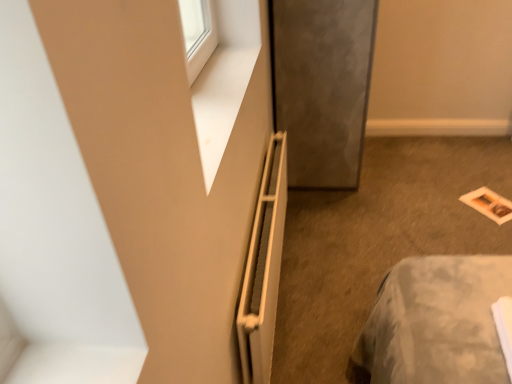
Question: Is matte paper magazine at lower right taller than matte gray screen door at center?

Choices:
 (A) no
 (B) yes

Answer: (A)

Question: Is matte gray screen door at center located within matte paper magazine at lower right?

Choices:
 (A) yes
 (B) no

Answer: (B)

Question: Can we say matte paper magazine at lower right lies outside matte gray screen door at center?

Choices:
 (A) no
 (B) yes

Answer: (B)

Question: Could you tell me if matte paper magazine at lower right is facing matte gray screen door at center?

Choices:
 (A) yes
 (B) no

Answer: (B)

Question: Are matte paper magazine at lower right and matte gray screen door at center far apart?

Choices:
 (A) yes
 (B) no

Answer: (A)

Question: From their relative heights in the image, would you say white matte radiator at center is taller or shorter than matte gray screen door at center?

Choices:
 (A) tall
 (B) short

Answer: (B)

Question: Choose the correct answer: Is white matte radiator at center inside matte gray screen door at center or outside it?

Choices:
 (A) outside
 (B) inside

Answer: (A)

Question: In the image, is white matte radiator at center positioned in front of or behind matte gray screen door at center?

Choices:
 (A) front
 (B) behind

Answer: (A)

Question: Considering the positions of point (246, 304) and point (352, 100), is point (246, 304) closer or farther from the camera than point (352, 100)?

Choices:
 (A) farther
 (B) closer

Answer: (B)

Question: Based on their sizes in the image, would you say matte gray screen door at center is bigger or smaller than matte paper magazine at lower right?

Choices:
 (A) big
 (B) small

Answer: (A)

Question: From a real-world perspective, is matte gray screen door at center positioned above or below matte paper magazine at lower right?

Choices:
 (A) below
 (B) above

Answer: (B)

Question: Considering the relative positions of matte gray screen door at center and matte paper magazine at lower right in the image provided, is matte gray screen door at center to the left or to the right of matte paper magazine at lower right?

Choices:
 (A) left
 (B) right

Answer: (A)

Question: Is matte gray screen door at center in front of or behind matte paper magazine at lower right in the image?

Choices:
 (A) front
 (B) behind

Answer: (A)

Question: Visually, is white matte radiator at center positioned to the left or to the right of matte paper magazine at lower right?

Choices:
 (A) right
 (B) left

Answer: (B)

Question: In terms of height, does white matte radiator at center look taller or shorter compared to matte paper magazine at lower right?

Choices:
 (A) tall
 (B) short

Answer: (A)